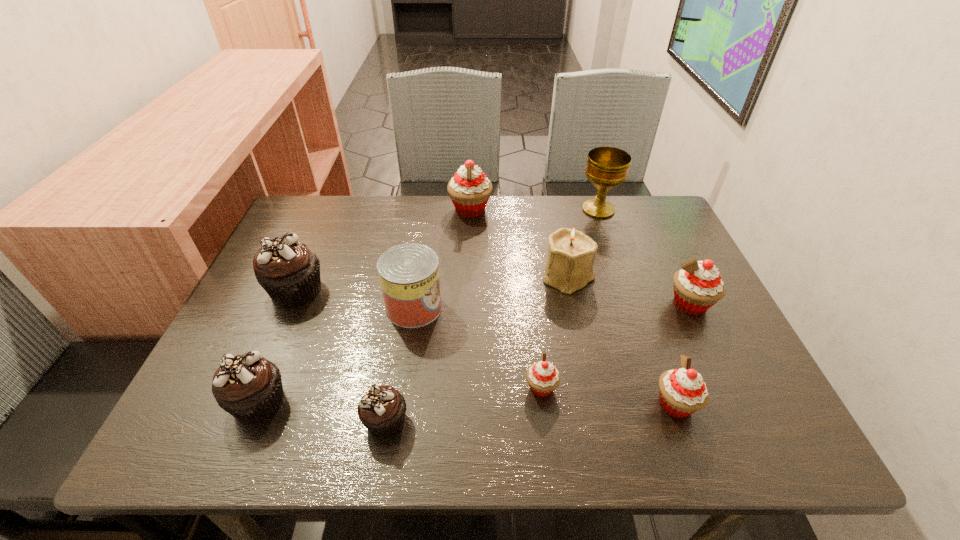
The height and width of the screenshot is (540, 960). I want to click on vacant space that is in between the second smallest pink cupcake and the candle_holder, so click(x=622, y=340).

Where is `empty space that is in between the third cupcake from left to right and the second biggest brown cupcake`? The image size is (960, 540). empty space that is in between the third cupcake from left to right and the second biggest brown cupcake is located at coordinates (323, 411).

Identify the location of free spot between the chalice and the smallest brown cupcake. (492, 315).

Locate an element on the screen. free spot between the second biggest brown cupcake and the second pink cupcake from right to left is located at coordinates (467, 403).

Locate an element on the screen. This screenshot has height=540, width=960. vacant region between the rightmost pink cupcake and the second pink cupcake from right to left is located at coordinates (683, 354).

The height and width of the screenshot is (540, 960). In order to click on free area in between the beige candle_holder and the second pink cupcake from left to right in this screenshot , I will do `click(555, 332)`.

Where is `vacant area between the can and the smallest brown cupcake`? vacant area between the can and the smallest brown cupcake is located at coordinates (400, 364).

Where is `object that is the nearest to the second smallest brown cupcake`? The height and width of the screenshot is (540, 960). object that is the nearest to the second smallest brown cupcake is located at coordinates (382, 409).

This screenshot has width=960, height=540. Identify the location of the second closest object to the biggest brown cupcake. (249, 387).

Select which cupcake is the closest to the rightmost brown cupcake. Please provide its 2D coordinates. Your answer should be formatted as a tuple, i.e. [(x, y)], where the tuple contains the x and y coordinates of a point satisfying the conditions above.

[(249, 387)]